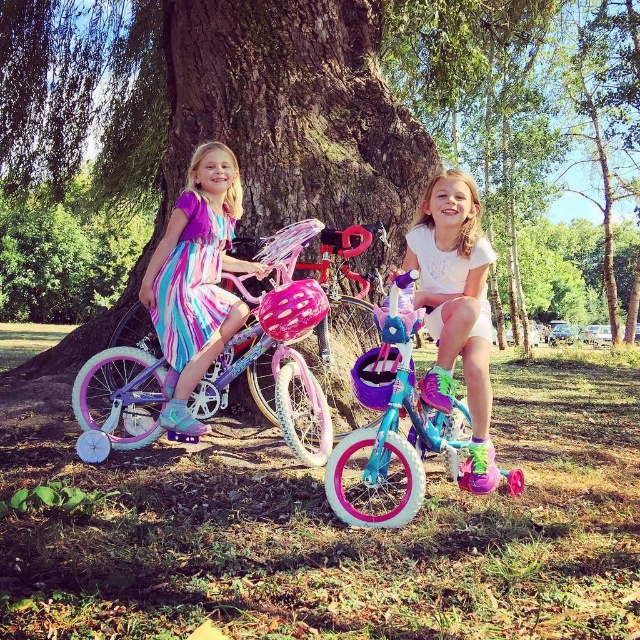
Where is the teal glossy bicycle at center located in the image?

The teal glossy bicycle at center is located at point 0.659 on the x axis and 0.614 on the y axis.

You are standing in the park and see the image. There is a point at coordinates (x=392, y=420). What object is located at this point?

The point at coordinates (x=392, y=420) indicates the teal glossy bicycle at center.

You are standing in the park and see the teal glossy bicycle at center. If you want to touch it, how many steps do you need to take if each step covers 0.75 meters?

The teal glossy bicycle at center is 2.90 meters away. Since each step covers 0.75 meters, you would need to take approximately 4 steps to reach it because 2.90 divided by 0.75 is about 3.87, which rounds up to 4 steps.